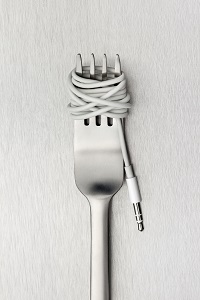
Find the location of `fork`. fork is located at coordinates (100, 168).